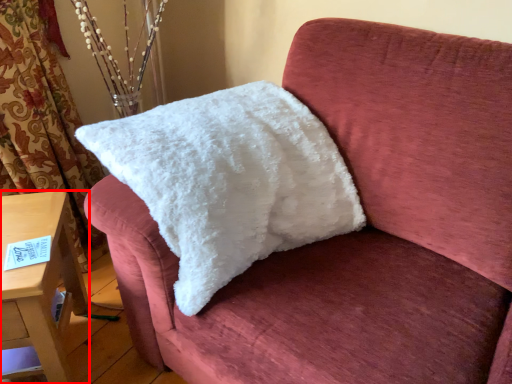
Question: Considering the relative positions of furniture (annotated by the red box) and pillow in the image provided, where is furniture (annotated by the red box) located with respect to the staircase?

Choices:
 (A) left
 (B) right

Answer: (A)